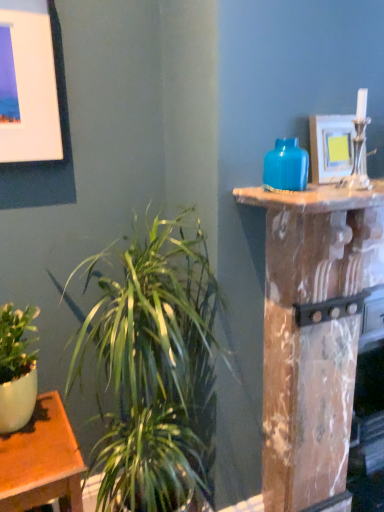
Question: Is point (278, 179) closer or farther from the camera than point (31, 117)?

Choices:
 (A) closer
 (B) farther

Answer: (A)

Question: Is matte blue vase at upper right taller or shorter than matte white picture frame at upper left, which is the 2th picture frame in right-to-left order?

Choices:
 (A) tall
 (B) short

Answer: (B)

Question: Which of these objects is positioned closest to the matte white picture frame at upper left, the first picture frame from the left?

Choices:
 (A) marble pillar at right
 (B) matte white picture frame at upper right, the 1th picture frame in the right-to-left sequence
 (C) matte blue vase at upper right
 (D) green leafy plant at center

Answer: (D)

Question: Estimate the real-world distances between objects in this image. Which object is farther from the matte blue vase at upper right?

Choices:
 (A) green leafy plant at center
 (B) marble pillar at right
 (C) matte white picture frame at upper right, which is the 2th picture frame in left-to-right order
 (D) matte white picture frame at upper left, which is the 2th picture frame in right-to-left order

Answer: (D)